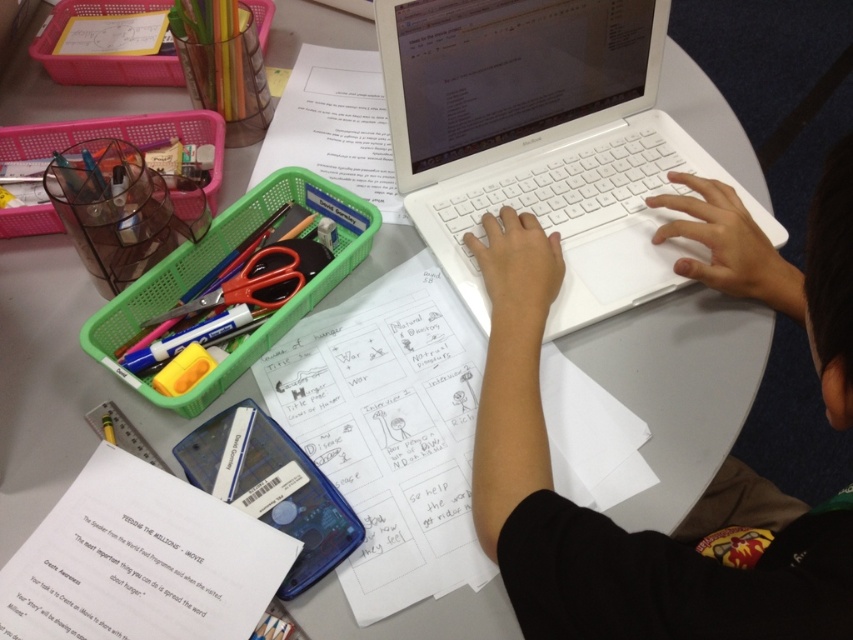
You are organizing your desk and want to place a new ruler between the white plastic laptop at center and the white paper at lower left. If the ruler is 12 inches long, will it fit in the space between them?

The distance between the white plastic laptop at center and the white paper at lower left is 18.36 inches. Since the ruler is only 12 inches long, it will fit comfortably within the space between them.

You are organizing the desk and need to place a new item on the white paper at lower left. According to the scene description, where exactly should you place it?

The white paper at lower left is located at point (140, 561), so you should place the new item at that coordinate.

You are organizing your desk and want to place both the white plastic hands at center and the blue plastic phone case at lower center into a drawer. The drawer can only accommodate items that are narrower than 10 centimeters. Based on their widths, can both items fit into the drawer?

The white plastic hands at center might be wider than blue plastic phone case at lower center. Since the drawer can only hold items narrower than 10 centimeters, it is uncertain if both will fit. The phone case might fit, but the hands might exceed the width limit.